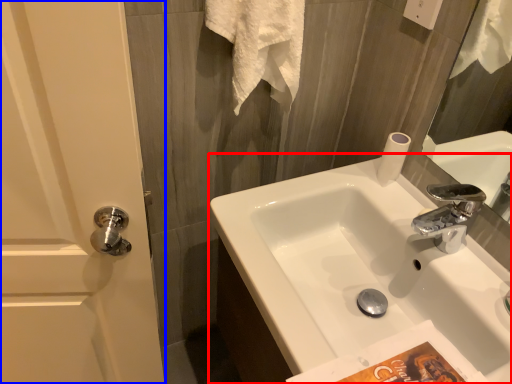
Question: Which object appears closest to the camera in this image, sink (highlighted by a red box) or screen door (highlighted by a blue box)?

Choices:
 (A) sink
 (B) screen door

Answer: (B)